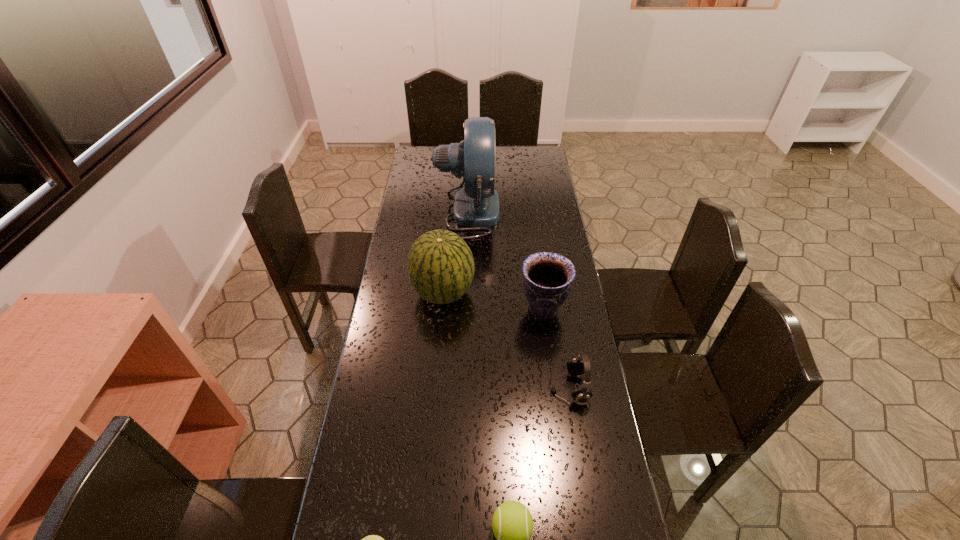
At what (x,y) coordinates should I click in order to perform the action: click on vacant area located 0.120m on the front handle of the fourth shortest object. Please return your answer as a coordinate pair (x, y). This screenshot has width=960, height=540. Looking at the image, I should click on (486, 309).

I want to click on free space located with the microphone on the side of the fourth farthest object, so click(528, 389).

At what (x,y) coordinates should I click in order to perform the action: click on vacant space located 0.390m with the microphone on the side of the fourth farthest object. Please return your answer as a coordinate pair (x, y). Looking at the image, I should click on (426, 389).

What are the coordinates of `free space located with the microphone on the side of the fourth farthest object` in the screenshot? It's located at (436, 389).

Find the location of a particular element. The width and height of the screenshot is (960, 540). fan situated at the left edge is located at coordinates (476, 205).

At what (x,y) coordinates should I click in order to perform the action: click on watermelon located in the left edge section of the desktop. Please return your answer as a coordinate pair (x, y). The image size is (960, 540). Looking at the image, I should click on (440, 265).

Locate an element on the screen. Image resolution: width=960 pixels, height=540 pixels. pottery positioned at the right edge is located at coordinates [x=547, y=279].

At what (x,y) coordinates should I click in order to perform the action: click on headset located in the right edge section of the desktop. Please return your answer as a coordinate pair (x, y). Looking at the image, I should click on (579, 365).

In the image, there is a desktop. Where is `free space at the far edge`? free space at the far edge is located at coordinates 496,163.

In the image, there is a desktop. Find the location of `vacant space at the left edge`. vacant space at the left edge is located at coordinates (396, 289).